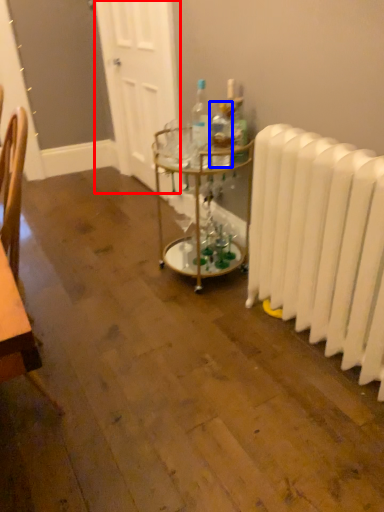
Question: Which point is closer to the camera, door (highlighted by a red box) or bottle (highlighted by a blue box)?

Choices:
 (A) door
 (B) bottle

Answer: (B)